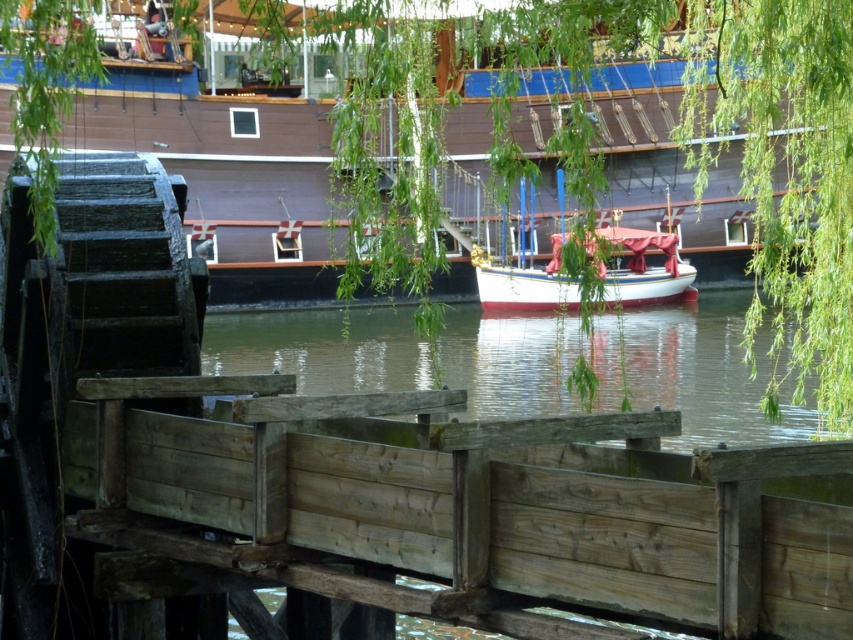
Question: Estimate the real-world distances between objects in this image. Which object is farther from the wooden ship at upper center?

Choices:
 (A) weathered wood dock at lower center
 (B) white glossy boat at center

Answer: (A)

Question: Is weathered wood dock at lower center in front of wooden ship at upper center?

Choices:
 (A) no
 (B) yes

Answer: (B)

Question: Can you confirm if weathered wood dock at lower center is smaller than white glossy boat at center?

Choices:
 (A) no
 (B) yes

Answer: (B)

Question: Is weathered wood dock at lower center above white glossy boat at center?

Choices:
 (A) no
 (B) yes

Answer: (A)

Question: Which point is farther from the camera taking this photo?

Choices:
 (A) [509, 280]
 (B) [111, 497]
 (C) [502, 132]

Answer: (A)

Question: Which of the following is the farthest from the observer?

Choices:
 (A) weathered wood dock at lower center
 (B) wooden ship at upper center

Answer: (B)